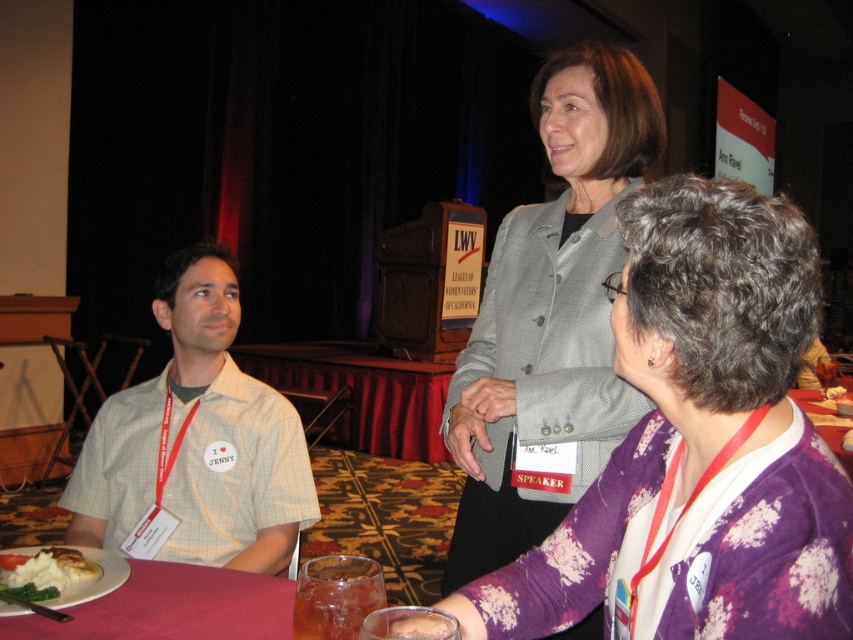
Between gray textured blazer at upper center and red fabric table at center, which one has more height?

Answer: With more height is red fabric table at center.

Between gray textured blazer at upper center and red fabric table at center, which one is positioned lower?

red fabric table at center is lower down.

Which is behind, point (727, 497) or point (440, 406)?

Point (440, 406)

Identify the location of gray textured blazer at upper center. (698, 444).

Which is more to the right, gray fabric jacket at upper center or red fabric table at center?

gray fabric jacket at upper center

Consider the image. Can you confirm if gray fabric jacket at upper center is taller than red fabric table at center?

Indeed, gray fabric jacket at upper center has a greater height compared to red fabric table at center.

Does point (485, 488) lie in front of point (380, 410)?

Yes, point (485, 488) is in front of point (380, 410).

This screenshot has height=640, width=853. I want to click on gray fabric jacket at upper center, so click(x=550, y=317).

Is the position of red fabric table at center more distant than that of white mashed potato at lower left?

Yes, red fabric table at center is further from the viewer.

Is point (399, 438) behind point (77, 589)?

Yes, it is.

Where is `red fabric table at center`? red fabric table at center is located at coordinates (363, 392).